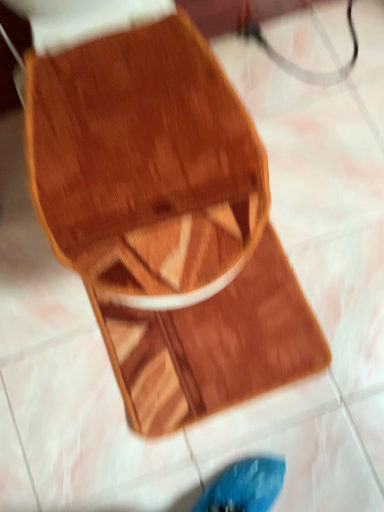
Question: Would you say wooden shoe at center is to the left or to the right of wooden cutting board at center in the picture?

Choices:
 (A) right
 (B) left

Answer: (A)

Question: In terms of height, does wooden shoe at center look taller or shorter compared to wooden cutting board at center?

Choices:
 (A) short
 (B) tall

Answer: (B)

Question: Would you say wooden shoe at center is inside or outside wooden cutting board at center?

Choices:
 (A) inside
 (B) outside

Answer: (B)

Question: Considering their positions, is wooden cutting board at center located in front of or behind wooden shoe at center?

Choices:
 (A) front
 (B) behind

Answer: (B)

Question: Is wooden cutting board at center spatially inside wooden shoe at center, or outside of it?

Choices:
 (A) inside
 (B) outside

Answer: (A)

Question: In terms of size, does wooden cutting board at center appear bigger or smaller than wooden shoe at center?

Choices:
 (A) big
 (B) small

Answer: (B)

Question: Is point (230, 334) positioned closer to the camera than point (307, 344)?

Choices:
 (A) farther
 (B) closer

Answer: (A)